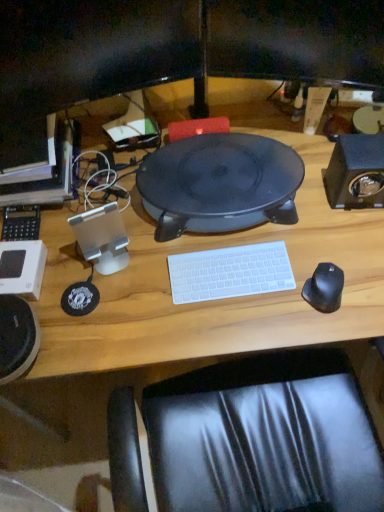
Where is `free space above wooden desk at center (from a real-world perspective)`? This screenshot has height=512, width=384. free space above wooden desk at center (from a real-world perspective) is located at coordinates (231, 225).